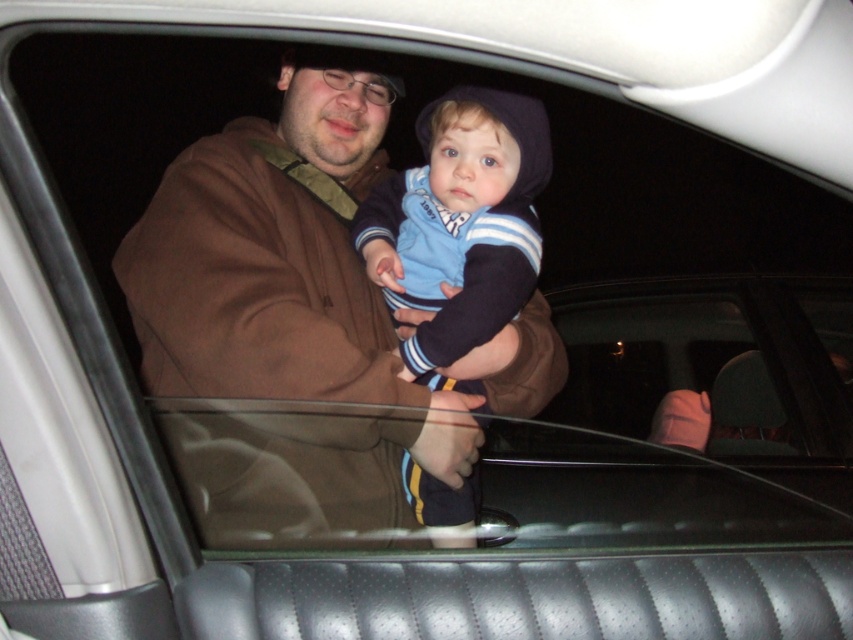
From the picture: Measure the distance between point (x=303, y=312) and camera.

Point (x=303, y=312) and camera are 1.54 meters apart.

Does brown fleece jacket at center come behind blue striped sweater at center?

That is False.

What do you see at coordinates (305, 316) in the screenshot?
I see `brown fleece jacket at center` at bounding box center [305, 316].

You are a GUI agent. You are given a task and a screenshot of the screen. Output one action in this format:
    pyautogui.click(x=<x>, y=<y>)
    Task: Click on the brown fleece jacket at center
    The image size is (853, 640).
    Given the screenshot: What is the action you would take?
    pyautogui.click(x=305, y=316)